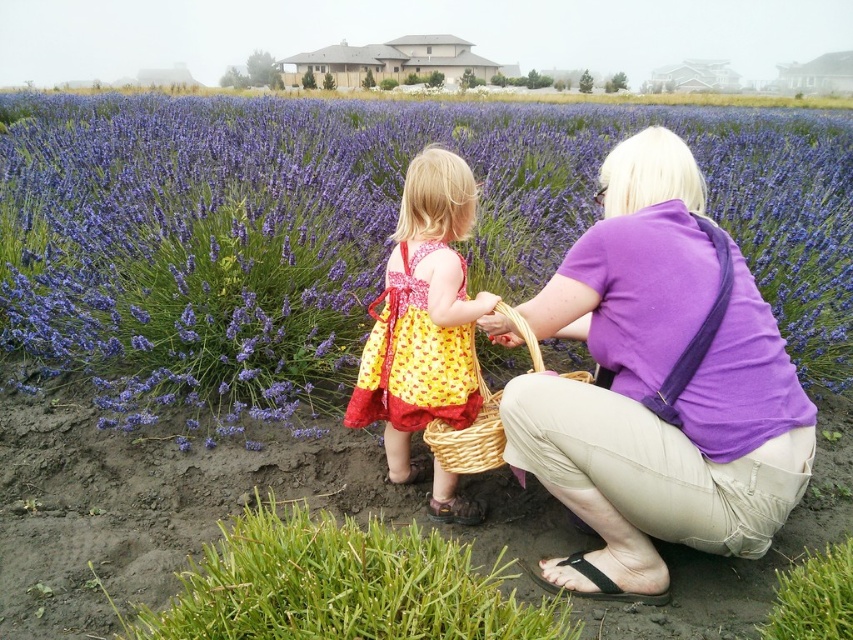
Question: Which of the following is the closest to the observer?

Choices:
 (A) (88, 257)
 (B) (366, 365)
 (C) (374, 396)
 (D) (660, 230)

Answer: (D)

Question: Among these points, which one is farthest from the camera?

Choices:
 (A) (701, 204)
 (B) (480, 442)
 (C) (315, 230)
 (D) (444, 385)

Answer: (C)

Question: Which object is positioned farthest from the purple cotton shirt at center?

Choices:
 (A) woven wicker basket at center
 (B) yellow dotted fabric dress at center
 (C) purple soft lavender at center
 (D) yellow printed dress at center

Answer: (C)

Question: Does yellow dotted fabric dress at center lie in front of woven wicker basket at center?

Choices:
 (A) yes
 (B) no

Answer: (B)

Question: Is purple cotton shirt at center smaller than yellow dotted fabric dress at center?

Choices:
 (A) yes
 (B) no

Answer: (B)

Question: Does purple cotton shirt at center appear on the right side of woven wicker basket at center?

Choices:
 (A) yes
 (B) no

Answer: (A)